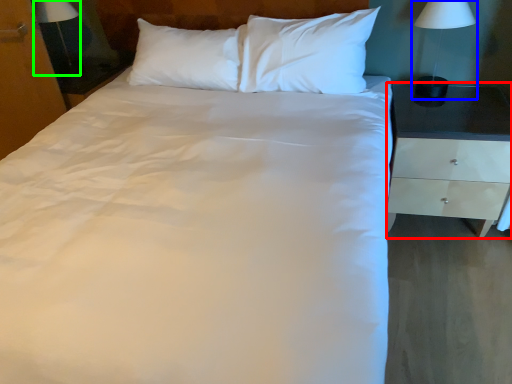
Question: Based on their relative distances, which object is nearer to nightstand (highlighted by a red box)? Choose from bedside lamp (highlighted by a blue box) and bedside lamp (highlighted by a green box).

Choices:
 (A) bedside lamp
 (B) bedside lamp

Answer: (A)